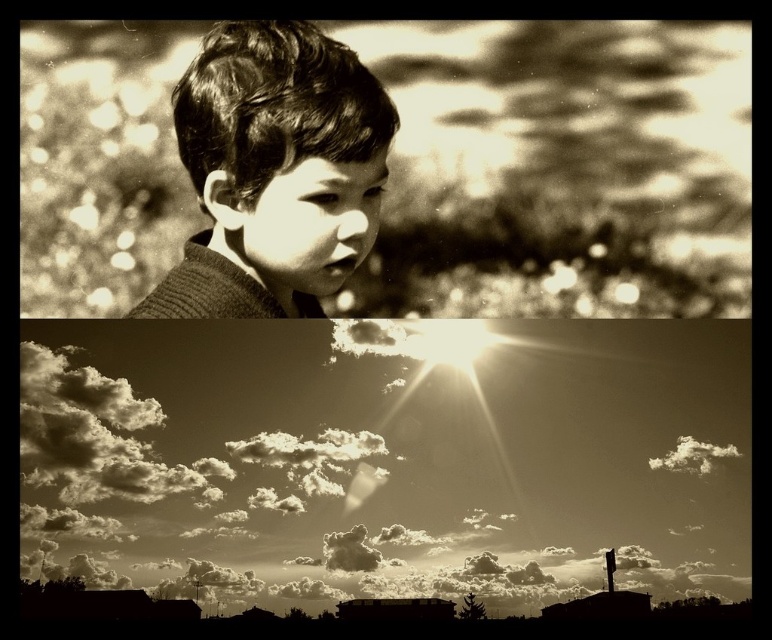
In the scene shown: Which of these two, cloudy sky at upper center or fuzzy white cloud at upper center, stands taller?

Standing taller between the two is cloudy sky at upper center.

Between cloudy sky at upper center and fuzzy white cloud at upper center, which one appears on the right side from the viewer's perspective?

Positioned to the right is fuzzy white cloud at upper center.

In order to click on cloudy sky at upper center in this screenshot , I will do `click(384, 460)`.

Between cloudy sky at upper center and matte black hair at upper center, which one has more height?

Standing taller between the two is cloudy sky at upper center.

Does point (418, 496) come in front of point (236, 26)?

No, it is not.

Between point (733, 432) and point (303, 51), which one is positioned in front?

Point (303, 51) is more forward.

Locate an element on the screen. The height and width of the screenshot is (640, 772). cloudy sky at upper center is located at coordinates (384, 460).

Which is more to the right, matte black hair at upper center or fuzzy white cloud at upper center?

Positioned to the right is fuzzy white cloud at upper center.

Can you confirm if matte black hair at upper center is positioned to the left of fuzzy white cloud at upper center?

Correct, you'll find matte black hair at upper center to the left of fuzzy white cloud at upper center.

Is point (313, 145) positioned in front of point (682, 465)?

Yes, point (313, 145) is closer to viewer.

Locate an element on the screen. The width and height of the screenshot is (772, 640). matte black hair at upper center is located at coordinates (273, 172).